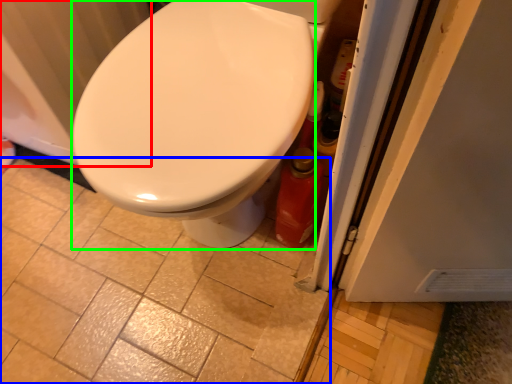
Question: Which is nearer to the radiator (highlighted by a red box)? ceramic tile (highlighted by a blue box) or bidet (highlighted by a green box).

Choices:
 (A) ceramic tile
 (B) bidet

Answer: (B)